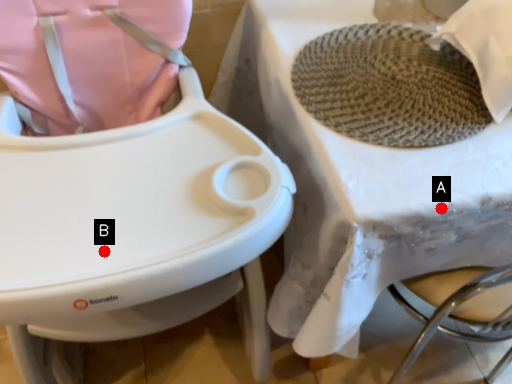
Question: Two points are circled on the image, labeled by A and B beside each circle. Which point appears closest to the camera in this image?

Choices:
 (A) A is closer
 (B) B is closer

Answer: (B)